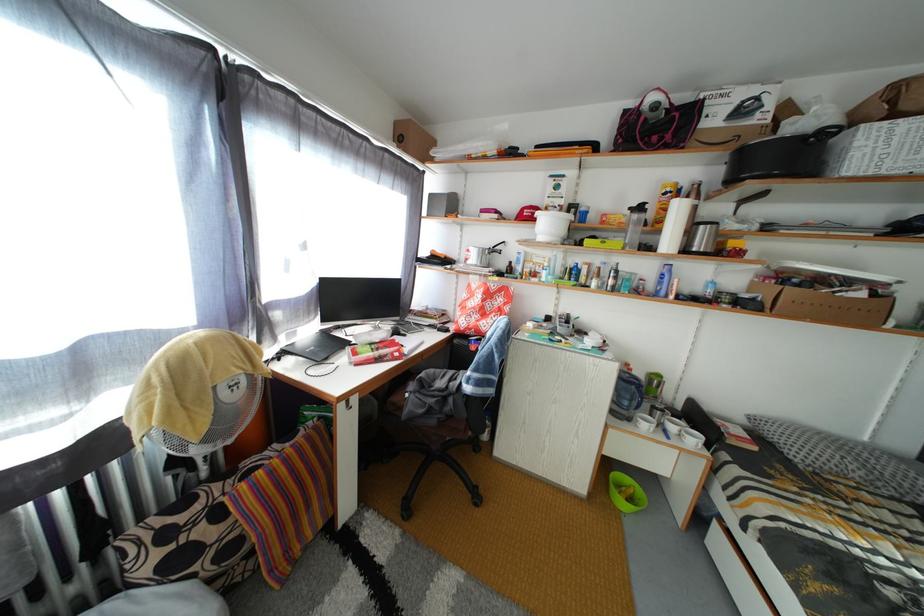
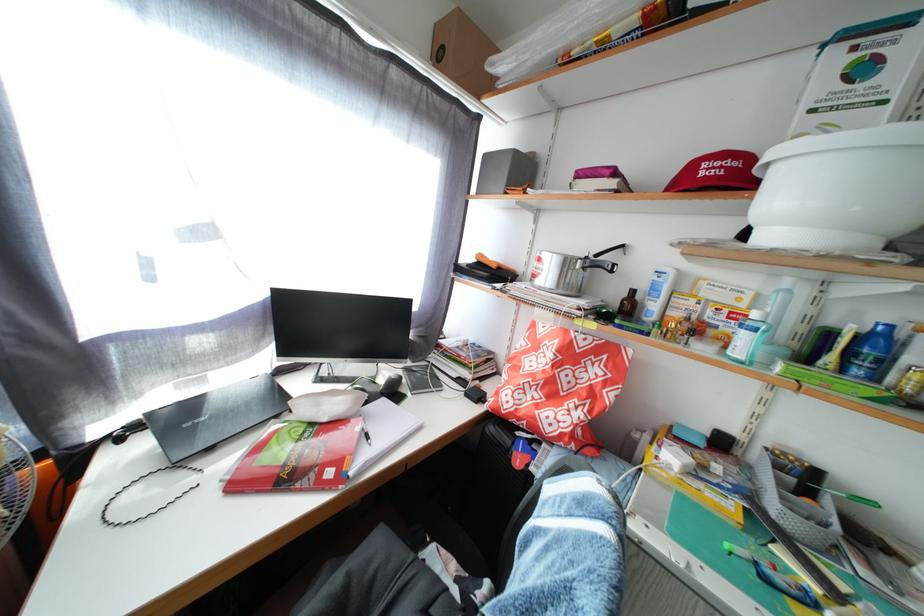
The point at (440, 201) is marked in the first image. Where is the corresponding point in the second image?

(494, 163)